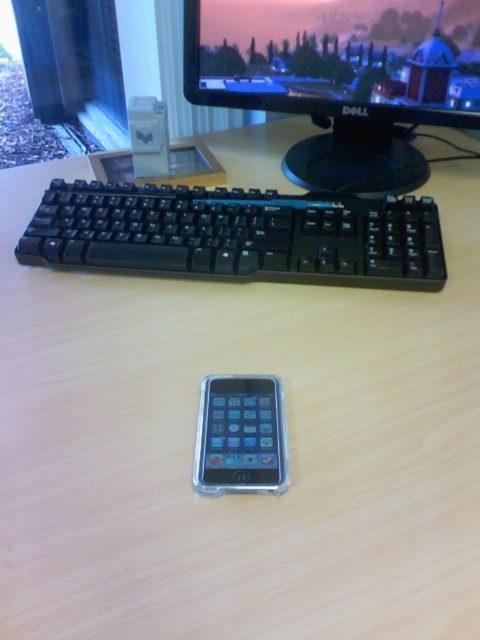
Based on the photo, you are standing in front of the workspace setup described. You need to place a new object at the exact coordinates of point (237, 234). What object will this new object be placed under?

The point (237, 234) corresponds to the black plastic keyboard at upper center, so the new object will be placed under the black plastic keyboard at upper center.

You are taking a photo of the workspace setup. You want to focus on the point at coordinates point (215, 264) and point (249, 424). Which point should you focus on first to ensure both are in focus?

Point (215, 264) is further to the camera than point (249, 424). To ensure both are in focus, you should focus on the closer point first, which is point (249, 424).

You are a person sitting at the desk and want to pick up the silver metallic smartphone at center. Can you reach it without moving the black plastic monitor at upper center?

The silver metallic smartphone at center is behind the black plastic monitor at upper center, so you cannot reach it without moving the monitor first.